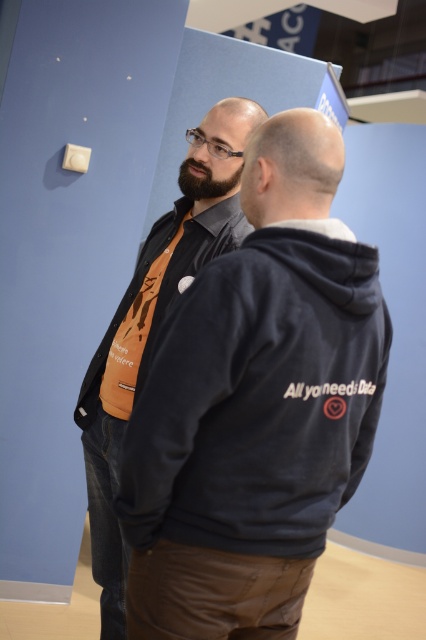
Question: Which point appears farthest from the camera in this image?

Choices:
 (A) (232, 140)
 (B) (141, 476)

Answer: (A)

Question: Based on their relative distances, which object is nearer to the dark blue fleece at center?

Choices:
 (A) matte black jacket at center
 (B) matte black hoodie at center

Answer: (B)

Question: Does matte black jacket at center appear over matte black hoodie at center?

Choices:
 (A) yes
 (B) no

Answer: (B)

Question: Among these objects, which one is nearest to the camera?

Choices:
 (A) dark blue fleece at center
 (B) matte black jacket at center

Answer: (A)

Question: Observing the image, what is the correct spatial positioning of dark blue fleece at center in reference to matte black jacket at center?

Choices:
 (A) below
 (B) above

Answer: (B)

Question: Observing the image, what is the correct spatial positioning of matte black jacket at center in reference to matte black hoodie at center?

Choices:
 (A) below
 (B) above

Answer: (A)